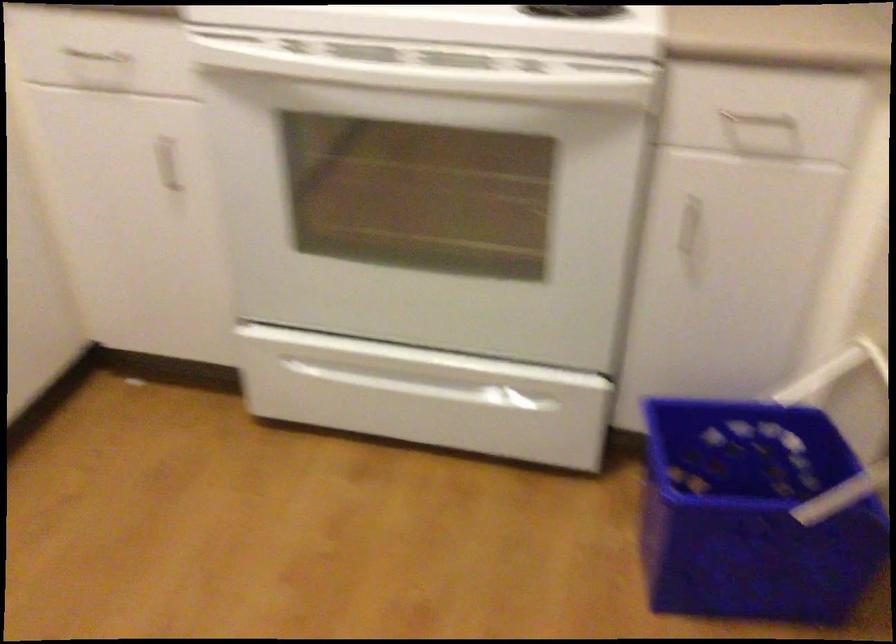
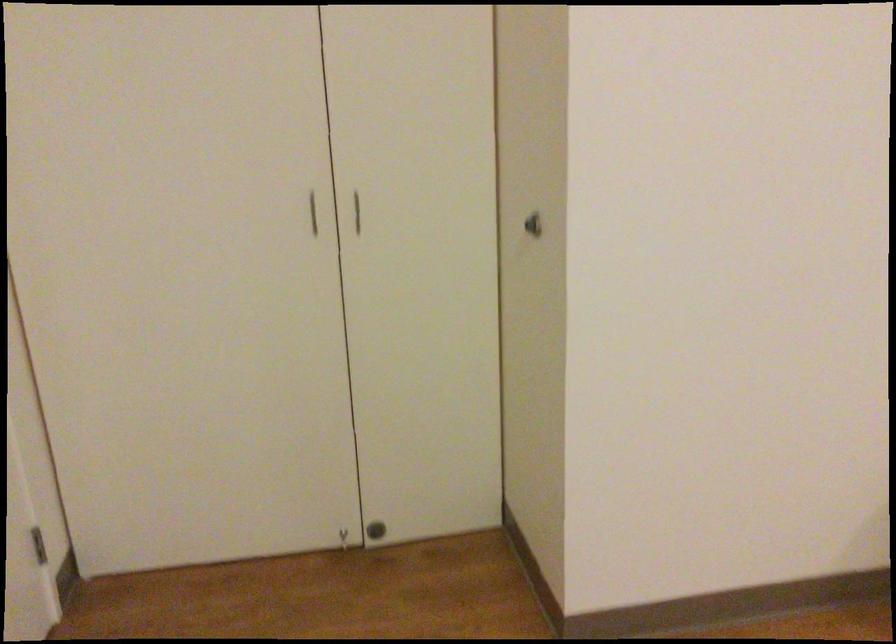
Based on the continuous images, in which direction is the camera rotating?

The camera rotated toward right-down.